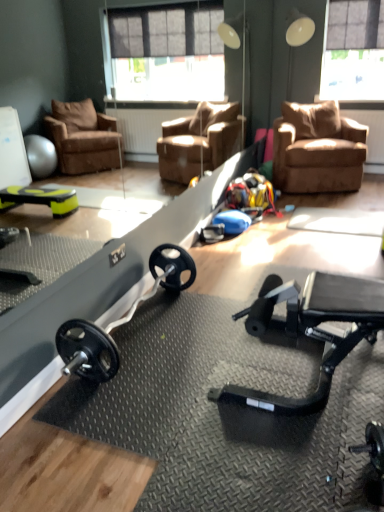
Where is `vacant area situated below black rubber barbell at center (from a real-world perspective)`? vacant area situated below black rubber barbell at center (from a real-world perspective) is located at coordinates (146, 324).